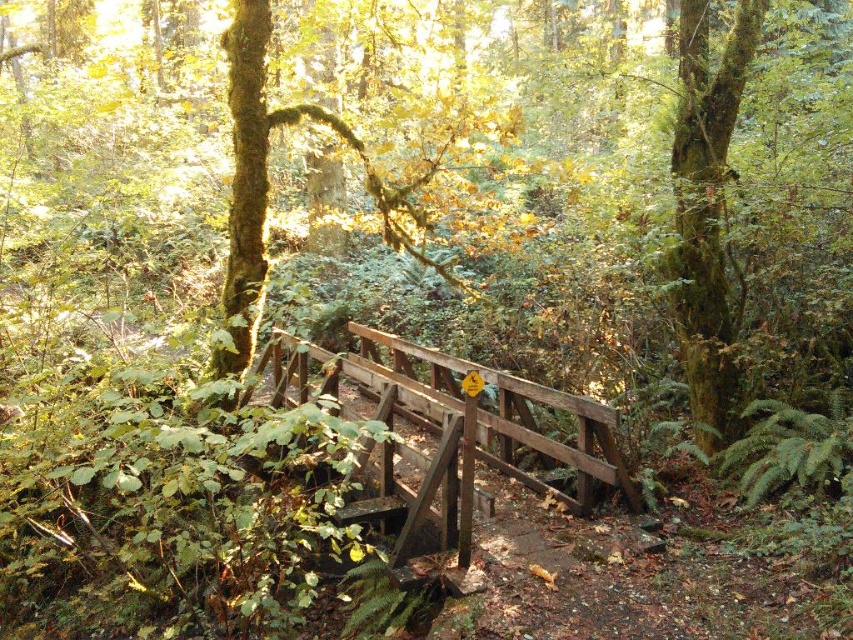
Question: Observing the image, what is the correct spatial positioning of green mossy tree at upper right in reference to green mossy tree at upper left?

Choices:
 (A) below
 (B) above

Answer: (A)

Question: Observing the image, what is the correct spatial positioning of wooden bridge at center in reference to green mossy tree at upper right?

Choices:
 (A) right
 (B) left

Answer: (B)

Question: Does wooden bridge at center lie behind green mossy tree at upper right?

Choices:
 (A) no
 (B) yes

Answer: (A)

Question: Which object is positioned farthest from the wooden bridge at center?

Choices:
 (A) green mossy tree at upper right
 (B) green mossy tree at upper left

Answer: (A)

Question: Which point appears farthest from the camera in this image?

Choices:
 (A) (422, 404)
 (B) (697, 173)
 (C) (236, 106)

Answer: (B)

Question: Which of these objects is positioned closest to the green mossy tree at upper left?

Choices:
 (A) wooden bridge at center
 (B) green mossy tree at upper right

Answer: (A)